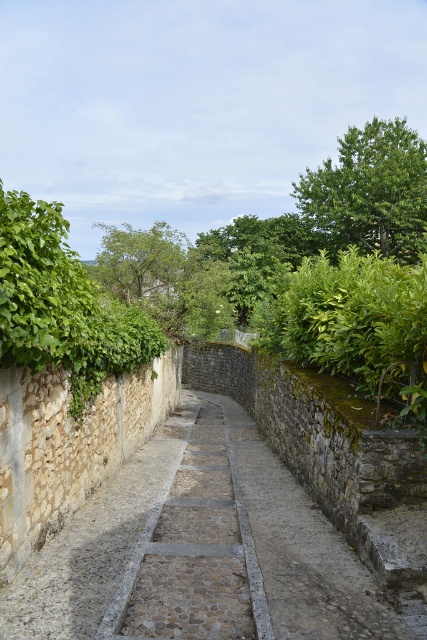
You are standing at the start of the stone pathway and want to walk to the green leafy tree at upper right. Which direction should you go relative to the green leafy tree at center?

The green leafy tree at upper right is positioned on the right side of the green leafy tree at center, so you should head towards the right side of the green leafy tree at center to reach it.

You are a gardener planning to plant a new tree that requires a minimum of 12 meters of space between it and any existing trees. You see the green leafy tree at upper right and the green leafy tree at center. Can you plant the new tree between them without violating the spacing requirement?

The green leafy tree at upper right is 13.54 meters from the green leafy tree at center. Since the required minimum spacing is 12 meters, planting the new tree between them would be possible as the existing distance already exceeds the required minimum.

You are standing at the starting point of the stone paved path at center. Which direction should you walk to avoid the dense hedge on the right side?

The stone paved path at center is located at point (202, 550), so you should walk towards the left side to avoid the dense hedge on the right side.